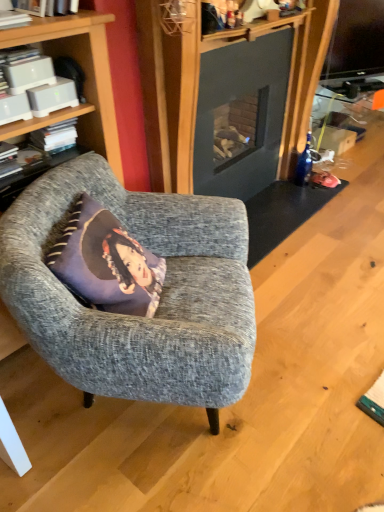
I want to click on free point above white plastic book at upper left, the second book positioned from the back (from a real-world perspective), so click(20, 52).